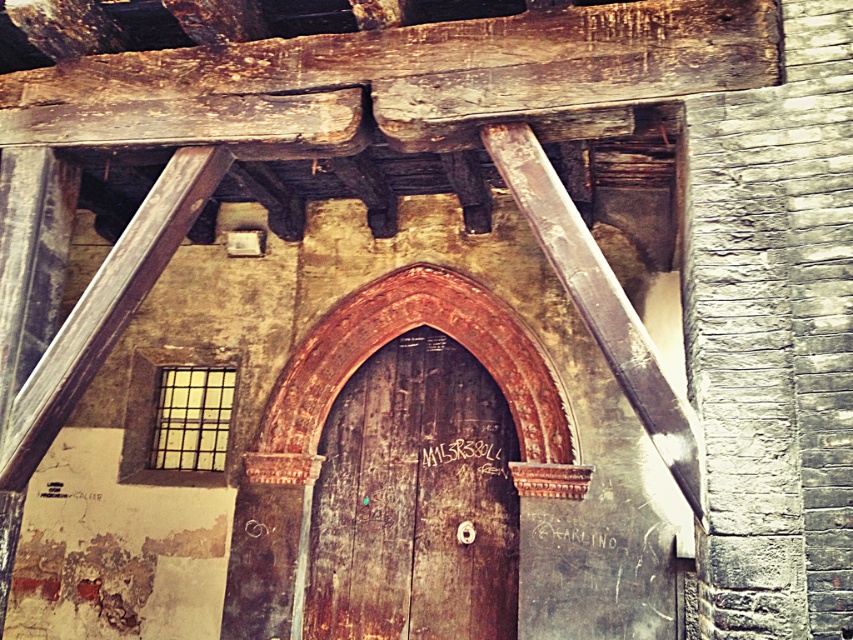
Question: Is rusty wood door at center above rusty metal beam at upper center?

Choices:
 (A) no
 (B) yes

Answer: (A)

Question: Which object is the farthest from the wooden beam at left?

Choices:
 (A) rusty metal beam at upper center
 (B) rusty wood door at center

Answer: (B)

Question: Does rusty wood door at center appear over rusty metal beam at upper center?

Choices:
 (A) yes
 (B) no

Answer: (B)

Question: Estimate the real-world distances between objects in this image. Which object is farther from the rusty wood door at center?

Choices:
 (A) rusty metal beam at upper center
 (B) wooden beam at left

Answer: (A)

Question: Which of these objects is positioned closest to the rusty wood door at center?

Choices:
 (A) rusty metal beam at upper center
 (B) wooden beam at left

Answer: (B)

Question: Is wooden beam at left below rusty metal beam at upper center?

Choices:
 (A) yes
 (B) no

Answer: (A)